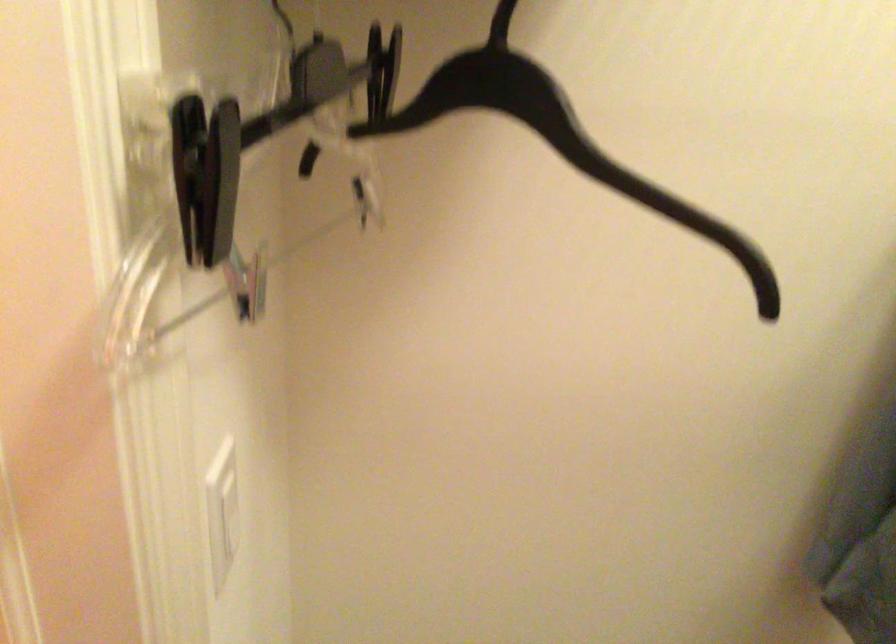
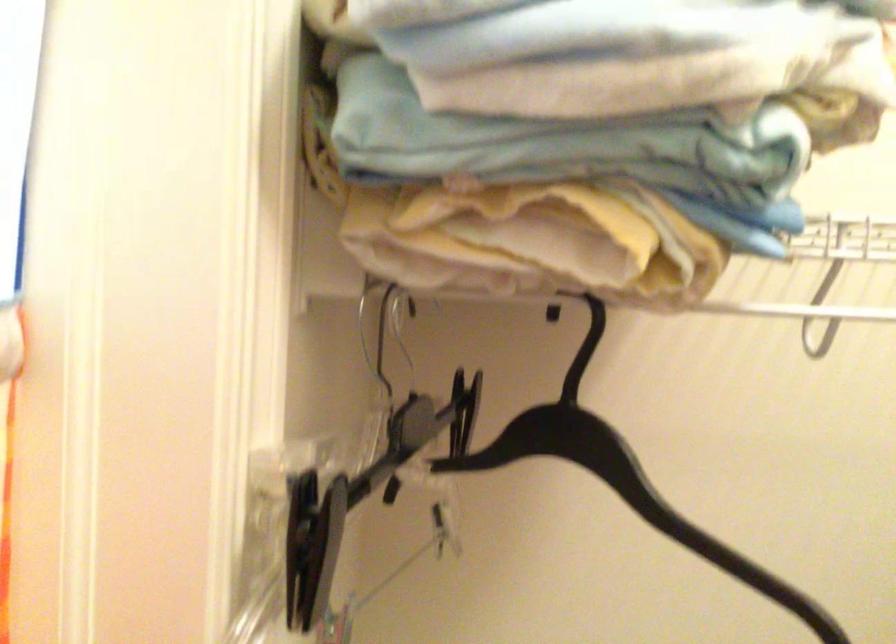
Question: Which direction would the cameraman need to move to produce the second image? Reply with the corresponding letter.

Choices:
 (A) Left
 (B) Right
 (C) Forward
 (D) Backward

Answer: (D)